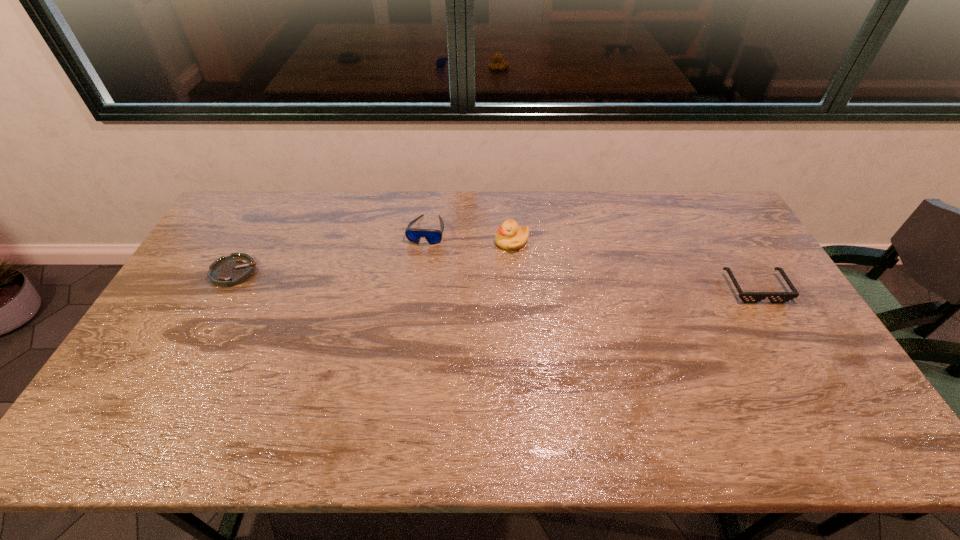
Where is `free spot located at the face of the tallest object`? free spot located at the face of the tallest object is located at coordinates (447, 273).

Locate an element on the screen. Image resolution: width=960 pixels, height=540 pixels. vacant space located 0.070m at the face of the tallest object is located at coordinates (481, 256).

Find the location of a particular element. vacant region located 0.080m at the face of the tallest object is located at coordinates (478, 258).

Locate an element on the screen. vacant space located 0.100m on the front-facing side of the taller sunglasses is located at coordinates (418, 267).

Find the location of a particular element. Image resolution: width=960 pixels, height=540 pixels. free space located 0.260m on the front-facing side of the taller sunglasses is located at coordinates (408, 306).

This screenshot has height=540, width=960. Find the location of `vacant space located on the front-facing side of the taller sunglasses`. vacant space located on the front-facing side of the taller sunglasses is located at coordinates (419, 265).

Locate an element on the screen. This screenshot has width=960, height=540. duckling situated at the far edge is located at coordinates (510, 236).

Identify the location of sunglasses at the far edge. (433, 236).

Locate an element on the screen. The height and width of the screenshot is (540, 960). object located at the left edge is located at coordinates (228, 271).

Locate an element on the screen. The width and height of the screenshot is (960, 540). object located at the right edge is located at coordinates (747, 297).